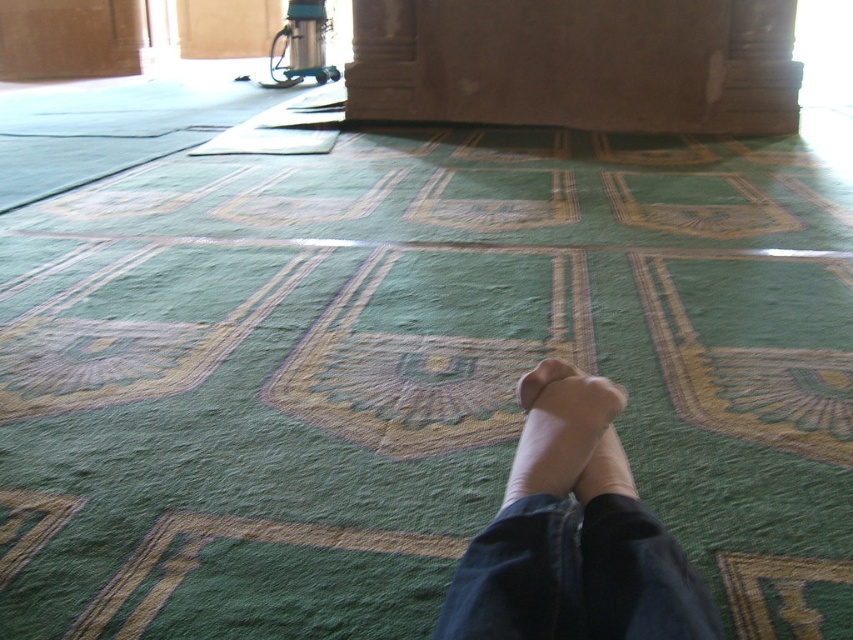
Question: Where is smooth beige socks at center located in relation to suede-like beige foot at lower center in the image?

Choices:
 (A) above
 (B) below

Answer: (B)

Question: Can you confirm if smooth beige socks at center is positioned to the right of suede-like beige foot at lower center?

Choices:
 (A) no
 (B) yes

Answer: (A)

Question: Can you confirm if smooth beige socks at center is wider than suede-like beige foot at lower center?

Choices:
 (A) yes
 (B) no

Answer: (A)